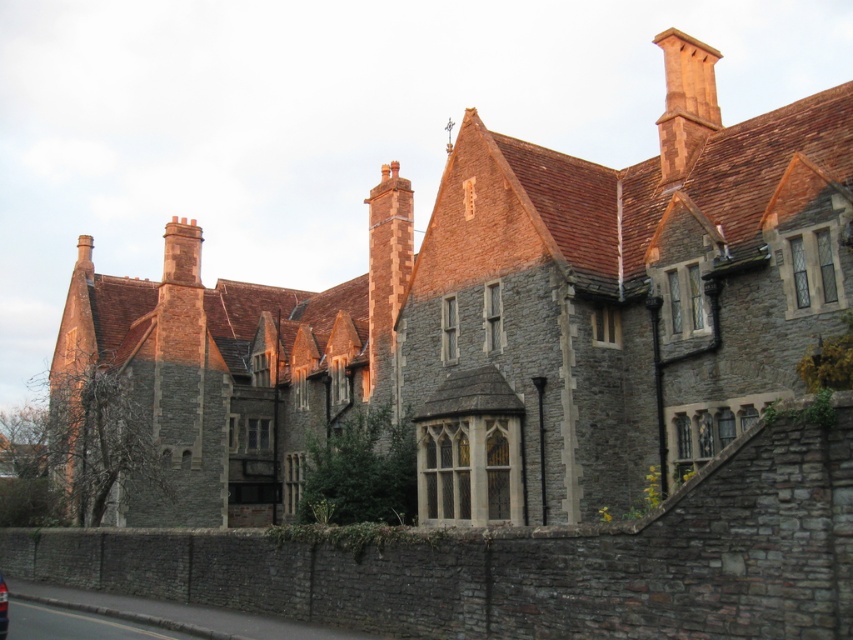
You are standing in front of the historic stone building and notice two points marked on the building. The first point is at coordinate point (674, 45) and the second is at point (0, 605). Which point is closer to your eyes?

Point (674, 45) is further to the camera than point (0, 605), so the point closer to your eyes is point (0, 605).

You are standing in front of the historic stone building and notice two points marked on the structure. The first point is at coordinates point(381,374) and the second at point(1,577). Which point is closer to you?

Point(381,374) is in front of point(1,577), so it is closer to you.

You are standing in front of the historic stone building. Where is the brick chimney at center located in terms of coordinates?

The brick chimney at center is located at point coordinates of (x=387, y=278).